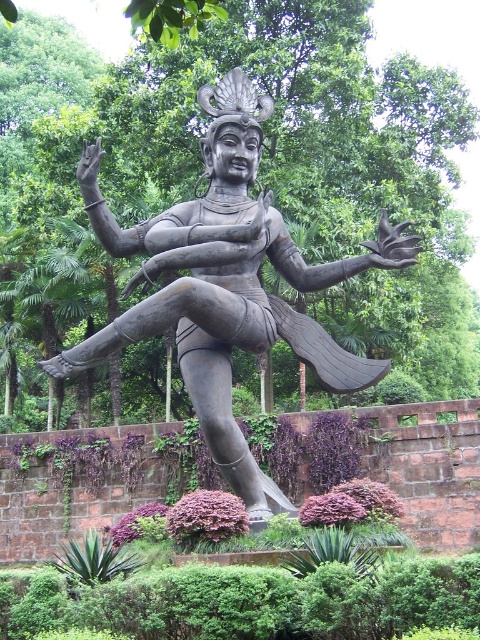
How distant is bronze statue at center from green leafy plants at center?

bronze statue at center is 15.10 meters away from green leafy plants at center.

Between point (414, 253) and point (129, 493), which one is positioned in front?

Positioned in front is point (414, 253).

Between point (213, 336) and point (358, 419), which one is positioned in front?

Point (213, 336) is in front.

Where is `bronze statue at center`? The height and width of the screenshot is (640, 480). bronze statue at center is located at coordinates (227, 284).